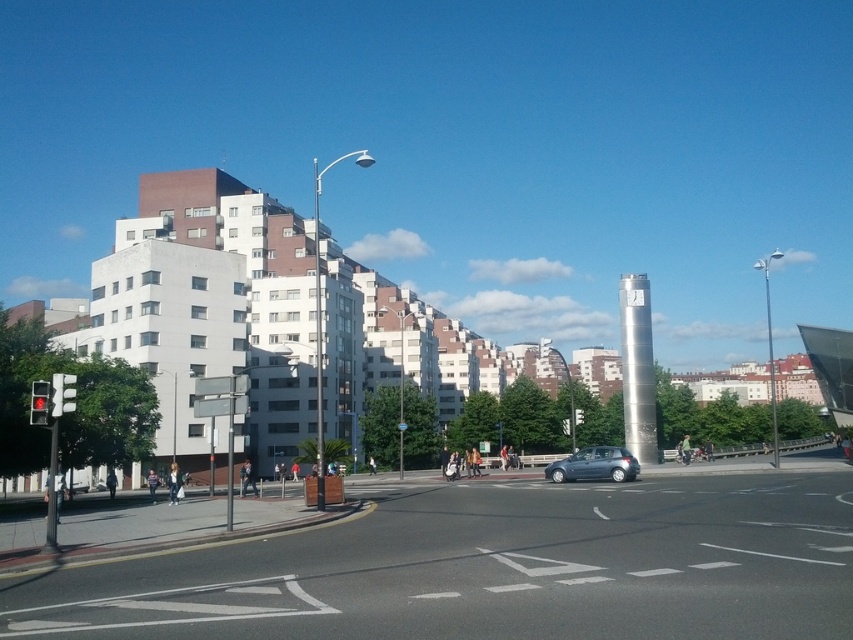
Which is more to the left, satin silver hatchback at center or matte black traffic light at left?

matte black traffic light at left is more to the left.

Can you confirm if satin silver hatchback at center is positioned above matte black traffic light at left?

No.

What are the coordinates of `satin silver hatchback at center` in the screenshot? It's located at (595, 465).

Locate an element on the screen. satin silver hatchback at center is located at coordinates (595, 465).

Who is shorter, black asphalt road at lower center or red glass traffic light at left?

red glass traffic light at left

Which is behind, point (540, 624) or point (33, 403)?

The point (33, 403) is more distant.

Where is `black asphalt road at lower center`? The width and height of the screenshot is (853, 640). black asphalt road at lower center is located at coordinates (492, 570).

Which of these two, black asphalt road at lower center or matte black traffic light at left, stands taller?

With more height is black asphalt road at lower center.

Which is above, black asphalt road at lower center or matte black traffic light at left?

Positioned higher is matte black traffic light at left.

Is point (566, 531) less distant than point (73, 404)?

No.

This screenshot has width=853, height=640. Find the location of `black asphalt road at lower center`. black asphalt road at lower center is located at coordinates (492, 570).